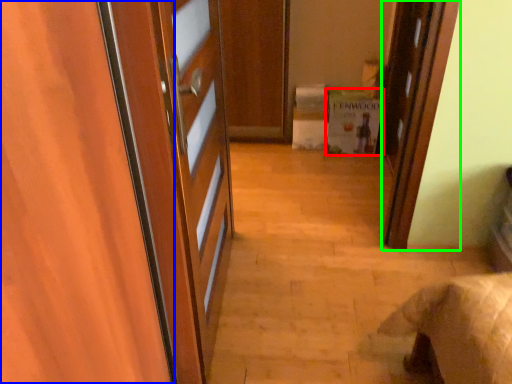
Question: Considering the real-world distances, which object is closest to cabinetry (highlighted by a red box)? door (highlighted by a blue box) or door (highlighted by a green box).

Choices:
 (A) door
 (B) door

Answer: (B)